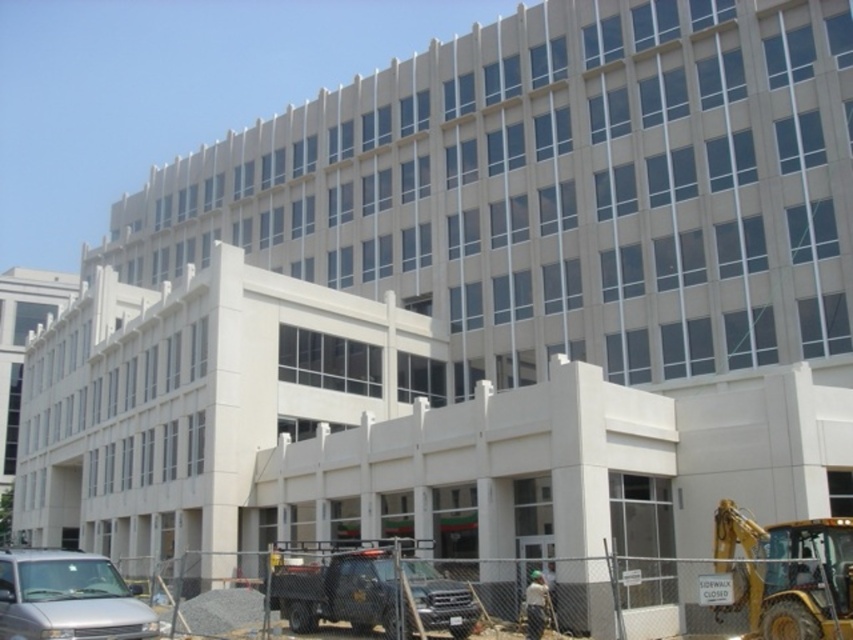
You are a delivery driver who needs to park your truck, which is 3 meters wide, in the construction site. The site manager says you can only park between the yellow metallic excavator at lower right and the matte black truck at lower center. Can your truck fit in that space?

The yellow metallic excavator at lower right has a lesser width compared to the matte black truck at lower center. Since your truck is 3 meters wide, it depends on the available space between them. However, since the excavator is narrower than the truck, there might be sufficient space if aligned properly. But without exact measurements, it is uncertain. The answer cannot be confirmed with the given information.

Consider the image. You are a delivery driver approaching the construction site. You see a silver metallic van at lower left and a green fabric construction worker at lower right. Which object is closer to the entrance of the building?

The silver metallic van at lower left is positioned under the green fabric construction worker at lower right, so the van is closer to the entrance of the building.